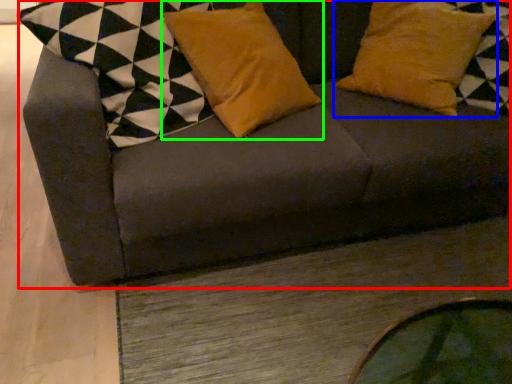
Question: Estimate the real-world distances between objects in this image. Which object is farther from studio couch (highlighted by a red box), pillow (highlighted by a blue box) or pillow (highlighted by a green box)?

Choices:
 (A) pillow
 (B) pillow

Answer: (A)